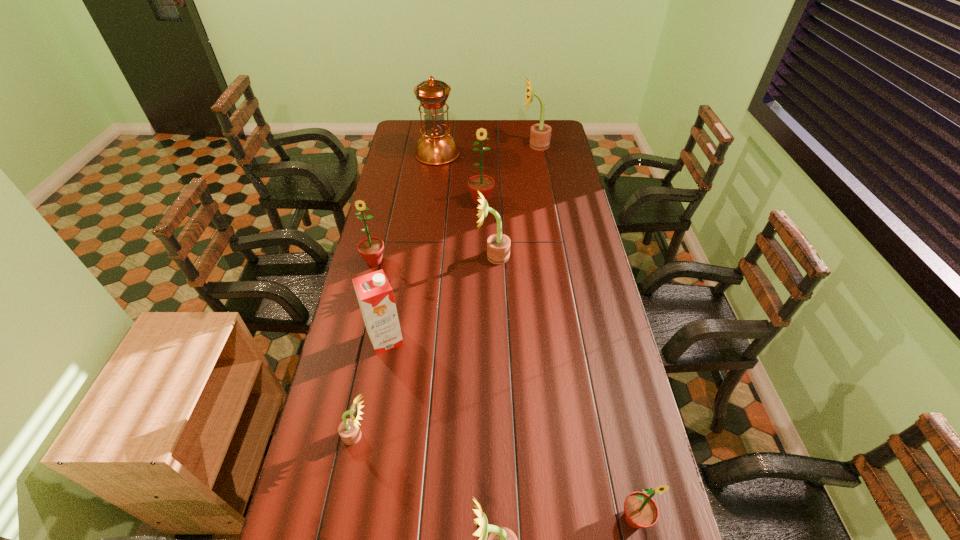
What are the coordinates of `vacant space at the right edge of the desktop` in the screenshot? It's located at (573, 195).

The image size is (960, 540). In the image, there is a desktop. What are the coordinates of `vacant space at the far left corner` in the screenshot? It's located at (416, 129).

Where is `vacant space at the far right corner of the desktop`? The height and width of the screenshot is (540, 960). vacant space at the far right corner of the desktop is located at coordinates (556, 137).

This screenshot has height=540, width=960. Find the location of `vacant space that is in between the smallest green sunflower and the shortest sunflower`. vacant space that is in between the smallest green sunflower and the shortest sunflower is located at coordinates (495, 477).

You are a GUI agent. You are given a task and a screenshot of the screen. Output one action in this format:
    pyautogui.click(x=<x>, y=<y>)
    Task: Click on the vacant space that's between the shortest object and the smallest green sunflower
    The image size is (960, 540).
    Given the screenshot: What is the action you would take?
    pyautogui.click(x=495, y=477)

Locate an element on the screen. Image resolution: width=960 pixels, height=540 pixels. free space between the third smallest yellow sunflower and the second biggest green sunflower is located at coordinates (434, 259).

Find the location of a particular element. Image resolution: width=960 pixels, height=540 pixels. blank region between the shortest sunflower and the second biggest green sunflower is located at coordinates (365, 349).

In order to click on empty location between the shortest object and the carton in this screenshot , I will do `click(371, 388)`.

Where is `free space between the second biggest green sunflower and the leftmost yellow sunflower`? Image resolution: width=960 pixels, height=540 pixels. free space between the second biggest green sunflower and the leftmost yellow sunflower is located at coordinates (365, 349).

Where is `vacant area that lies between the rightmost yellow sunflower and the sixth farthest object`? vacant area that lies between the rightmost yellow sunflower and the sixth farthest object is located at coordinates (460, 242).